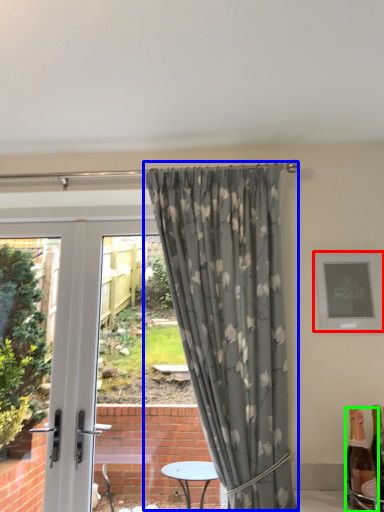
Question: Based on their relative distances, which object is nearer to picture frame (highlighted by a red box)? Choose from curtain (highlighted by a blue box) and bottle (highlighted by a green box).

Choices:
 (A) curtain
 (B) bottle

Answer: (A)